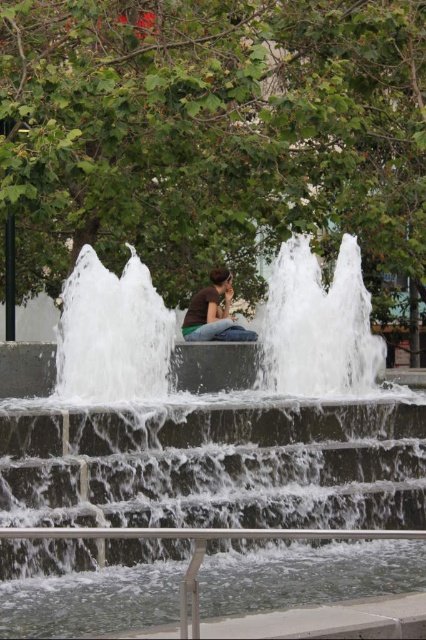
You are a photographer wanting to capture the white concrete fountain at center and the matte brown shirt at center in a single shot. Given the size difference between them, which object should you focus on to ensure both are clearly visible in the photo?

The white concrete fountain at center is larger than the matte brown shirt at center, so focusing on the fountain will ensure both objects are clearly visible in the photo.

You are standing in the park and want to take a photo of the white concrete fountain at center and the matte brown shirt at center. Which object should you place on the right side of your camera frame to ensure both are visible?

You should place the white concrete fountain at center on the right side of your camera frame because it is already positioned on the right side of the matte brown shirt at center, ensuring both are visible in the frame.